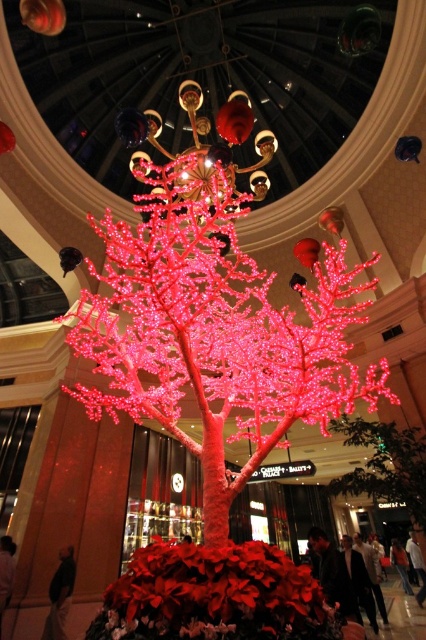
Question: Is illuminated plastic tree at center to the left of gold metallic chandelier at upper center from the viewer's perspective?

Choices:
 (A) yes
 (B) no

Answer: (B)

Question: Is illuminated plastic tree at center above gold metallic chandelier at upper center?

Choices:
 (A) no
 (B) yes

Answer: (A)

Question: Which point is farther to the camera?

Choices:
 (A) (92, 296)
 (B) (195, 93)

Answer: (A)

Question: Is illuminated plastic tree at center smaller than gold metallic chandelier at upper center?

Choices:
 (A) no
 (B) yes

Answer: (A)

Question: Which of the following is the farthest from the observer?

Choices:
 (A) gold metallic chandelier at upper center
 (B) illuminated plastic tree at center

Answer: (A)